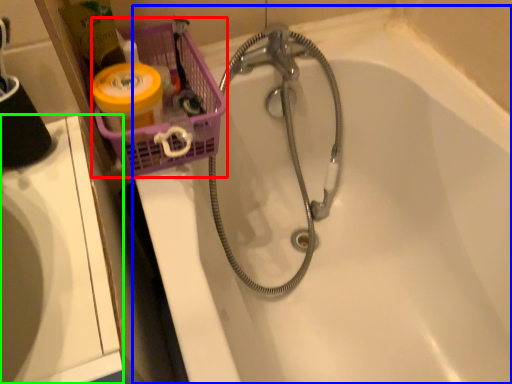
Question: Which is nearer to the basket (highlighted by a red box)? bathtub (highlighted by a blue box) or sink (highlighted by a green box).

Choices:
 (A) bathtub
 (B) sink

Answer: (B)